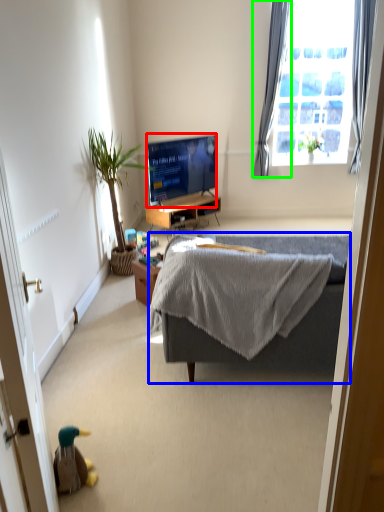
Question: Which object is the closest to the television (highlighted by a red box)? Choose among these: studio couch (highlighted by a blue box) or curtain (highlighted by a green box).

Choices:
 (A) studio couch
 (B) curtain

Answer: (B)